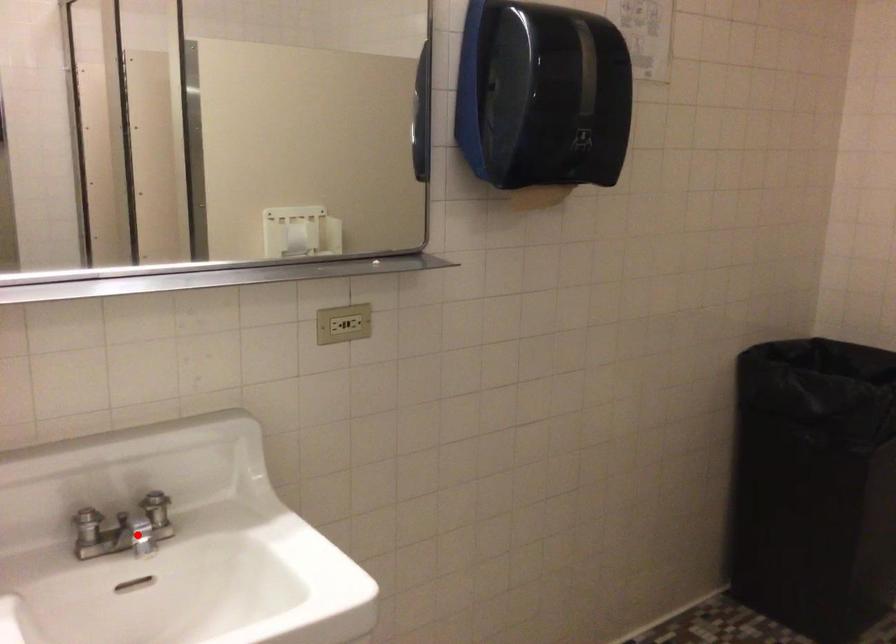
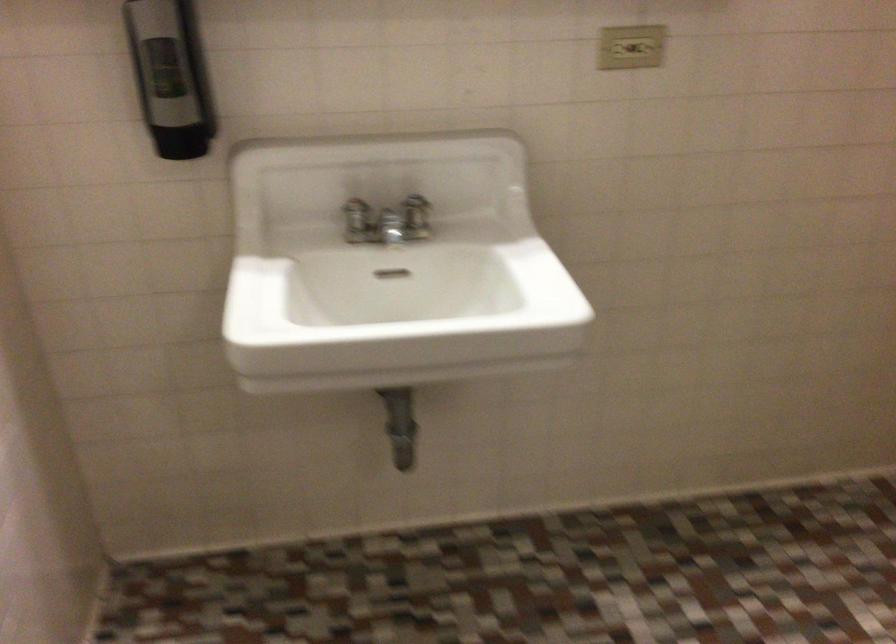
Question: I am providing you with two images of the same scene from different viewpoints. A red point is shown in image1. For the corresponding object point in image2, is it positioned nearer or farther from the camera?

Choices:
 (A) Nearer
 (B) Farther

Answer: (B)